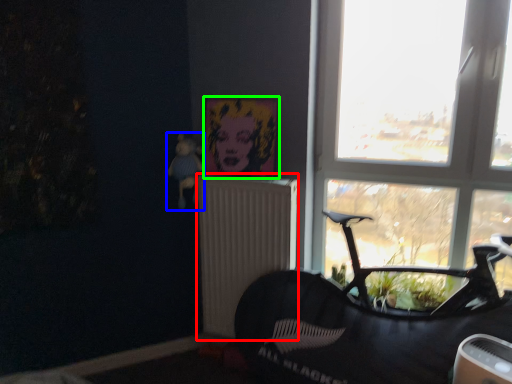
Question: Which object is positioned farthest from radiator (highlighted by a red box)? Select from toy (highlighted by a blue box) and picture frame (highlighted by a green box).

Choices:
 (A) toy
 (B) picture frame

Answer: (A)